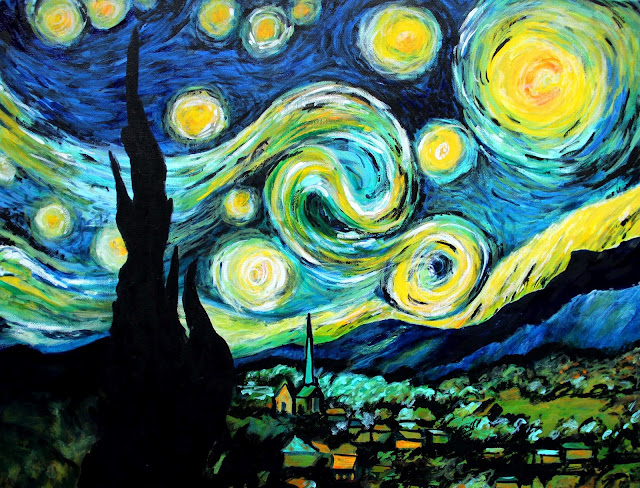
This screenshot has height=488, width=640. I want to click on grass in painting, so click(553, 409).